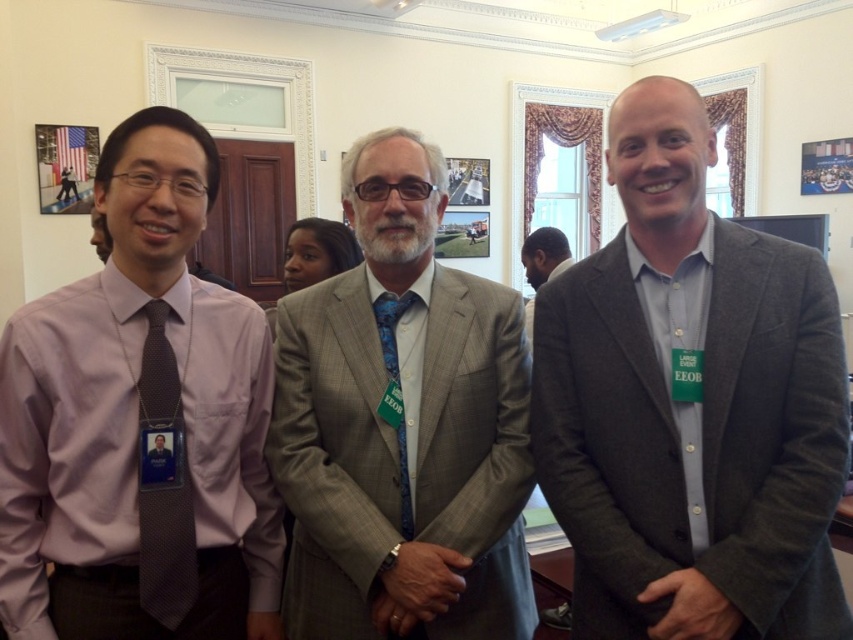
Question: Which point is farther to the camera?

Choices:
 (A) silver metallic watch at center
 (B) gray pinstripe suit at center

Answer: (B)

Question: Among these points, which one is nearest to the camera?

Choices:
 (A) (569, 260)
 (B) (428, 618)

Answer: (B)

Question: Observing the image, what is the correct spatial positioning of gray wool blazer at right in reference to gray pinstripe suit at center?

Choices:
 (A) left
 (B) right

Answer: (B)

Question: Which of these objects is positioned farthest from the silver metallic watch at center?

Choices:
 (A) gray suit at center
 (B) purple textured shirt at left
 (C) blue silk tie at center
 (D) gray pinstripe suit at center

Answer: (A)

Question: From the image, what is the correct spatial relationship of gray pinstripe suit at center in relation to dark gray fabric hand at center?

Choices:
 (A) below
 (B) above

Answer: (B)

Question: In this image, where is purple textured shirt at left located relative to dark gray fabric hand at center?

Choices:
 (A) left
 (B) right

Answer: (A)